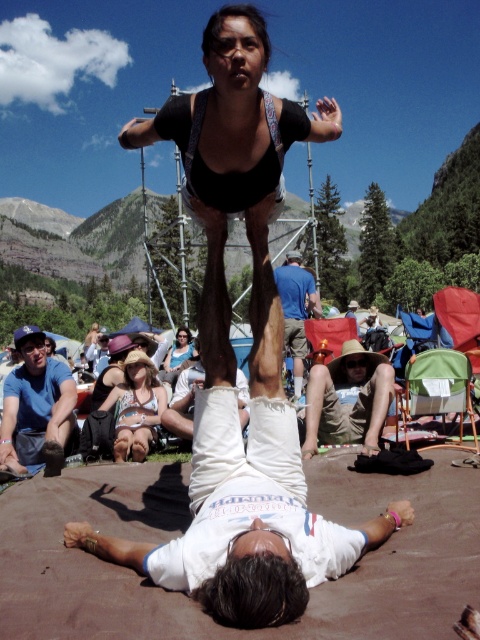
You are a photographer positioned at the center of the scene. You want to take a photo that includes both the point at [155,420] and the point at [295,278]. Which point should you focus on first to ensure both are in the frame?

You should focus on the point at [295,278] first because it is behind the point at [155,420]. By focusing on the farther point, you can ensure that both points are within the depth of field and in focus.

You are a photographer taking a picture of the acrobats. Which performer should you adjust your camera focus on first to ensure both are in frame? The white cotton tank top at center or the blue cotton shirt at center?

You should focus on the blue cotton shirt at center first because it is behind the white cotton tank top at center, ensuring both are in frame by starting with the one further away.

You are a photographer trying to capture the acrobats in the center of the image. You notice a point at coordinates (244, 472). What object is located at this point?

The point at coordinates (244, 472) indicates the white cotton pants at center.